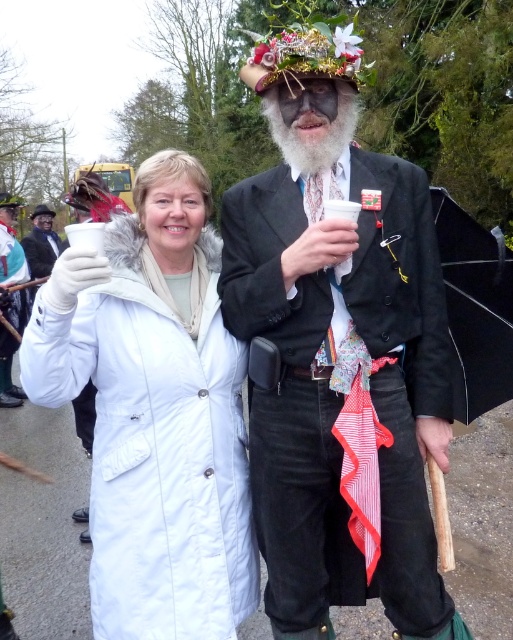
You are at a community event and see two points marked on the ground. One is at coordinates point (x=308, y=145) and the other at point (x=48, y=260). Which point is closer to you if you are facing north?

Point (x=308, y=145) is in front of point (x=48, y=260), so it is closer to you when facing north.